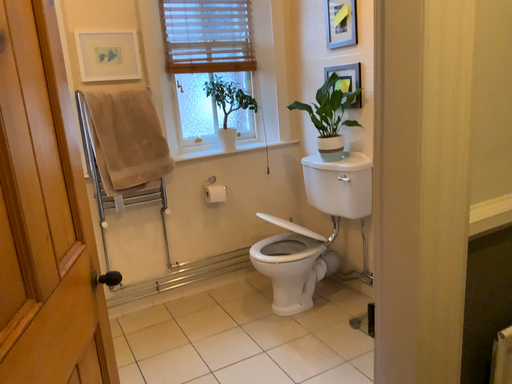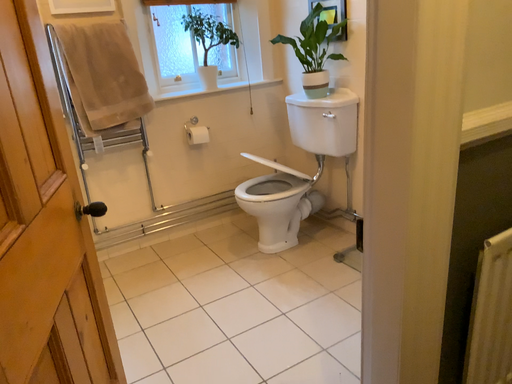
Question: How did the camera likely rotate when shooting the video?

Choices:
 (A) rotated downward
 (B) rotated upward

Answer: (A)